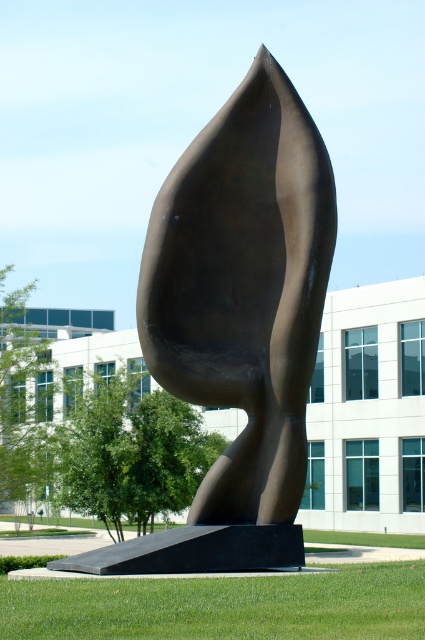
Question: Is bronze sculpture at center thinner than green grass at lower center?

Choices:
 (A) no
 (B) yes

Answer: (A)

Question: Which point is closer to the camera taking this photo?

Choices:
 (A) (255, 65)
 (B) (158, 589)

Answer: (B)

Question: Among these objects, which one is nearest to the camera?

Choices:
 (A) green grass at lower center
 (B) bronze sculpture at center

Answer: (A)

Question: Is bronze sculpture at center thinner than green grass at lower center?

Choices:
 (A) no
 (B) yes

Answer: (A)

Question: Is bronze sculpture at center thinner than green grass at lower center?

Choices:
 (A) no
 (B) yes

Answer: (A)